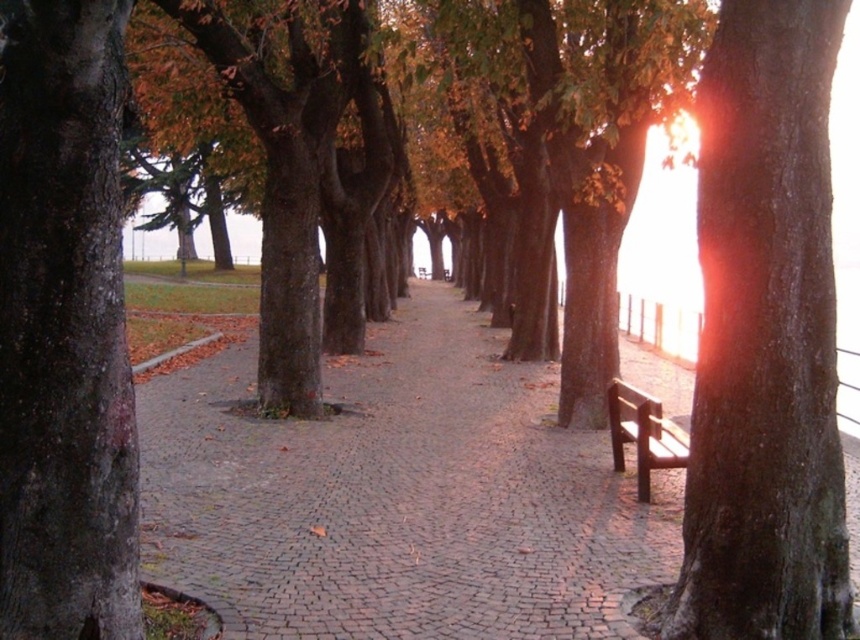
Question: Is cobblestone pavement at center smaller than brown wooden bench at right?

Choices:
 (A) yes
 (B) no

Answer: (B)

Question: Does cobblestone pavement at center have a larger size compared to brown wooden bench at right?

Choices:
 (A) yes
 (B) no

Answer: (A)

Question: Which point appears farthest from the camera in this image?

Choices:
 (A) (655, 449)
 (B) (754, 556)

Answer: (A)

Question: Which object is positioned farthest from the smooth brown bark at right?

Choices:
 (A) brown wooden bench at right
 (B) cobblestone pavement at center

Answer: (B)

Question: Is cobblestone pavement at center to the right of brown wooden bench at right from the viewer's perspective?

Choices:
 (A) yes
 (B) no

Answer: (B)

Question: Among these objects, which one is farthest from the camera?

Choices:
 (A) smooth brown bark at right
 (B) brown wooden bench at right
 (C) cobblestone pavement at center

Answer: (B)